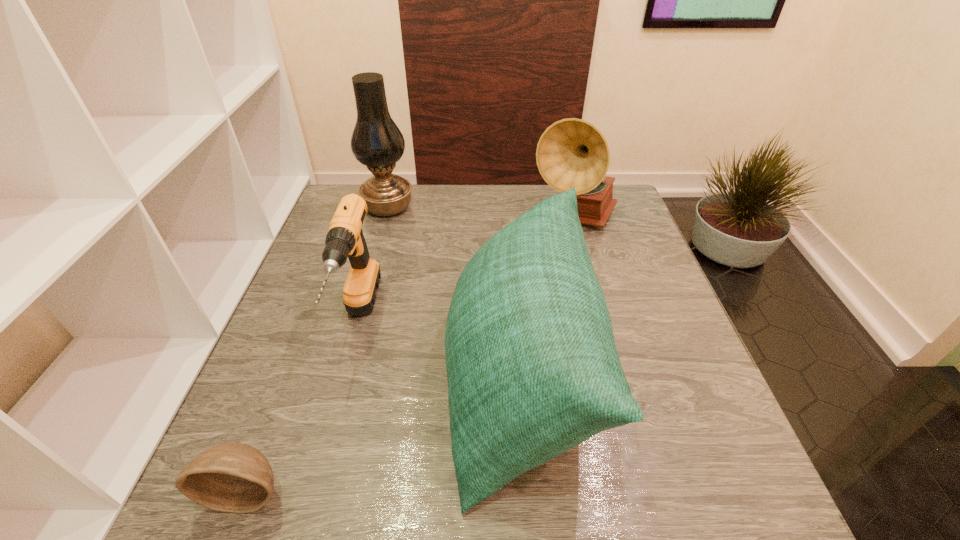
Find the location of `vacant point located between the fourth tallest object and the cushion`. vacant point located between the fourth tallest object and the cushion is located at coordinates (439, 348).

The width and height of the screenshot is (960, 540). I want to click on vacant area that lies between the oil lamp and the phonograph record, so click(481, 214).

This screenshot has width=960, height=540. I want to click on free space between the cushion and the bowl, so click(384, 435).

Image resolution: width=960 pixels, height=540 pixels. I want to click on free area in between the shortest object and the oil lamp, so pos(318,349).

Identify the location of vacant area that lies between the oil lamp and the bowl. (318, 349).

The width and height of the screenshot is (960, 540). In order to click on vacant point located between the cushion and the fourth tallest object in this screenshot , I will do `click(439, 348)`.

Locate an element on the screen. vacant point located between the cushion and the oil lamp is located at coordinates (454, 292).

Identify the location of object that ranks as the third closest to the oil lamp. (572, 152).

Point out which object is positioned as the second nearest to the bowl. Please provide its 2D coordinates. Your answer should be formatted as a tuple, i.e. [(x, y)], where the tuple contains the x and y coordinates of a point satisfying the conditions above.

[(532, 367)]

Locate an element on the screen. This screenshot has width=960, height=540. free space that satisfies the following two spatial constraints: 1. on the horn of the phonograph record; 2. on the front-facing side of the cushion is located at coordinates (617, 377).